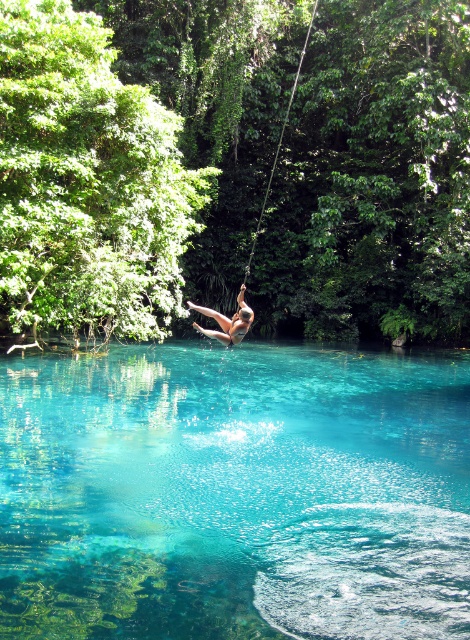
Question: Is transparent water at center bigger than smooth skin person at center?

Choices:
 (A) no
 (B) yes

Answer: (B)

Question: Among these objects, which one is farthest from the camera?

Choices:
 (A) smooth skin person at center
 (B) transparent water at center

Answer: (A)

Question: Does transparent water at center lie in front of smooth skin person at center?

Choices:
 (A) yes
 (B) no

Answer: (A)

Question: Can you confirm if transparent water at center is positioned to the left of smooth skin person at center?

Choices:
 (A) yes
 (B) no

Answer: (B)